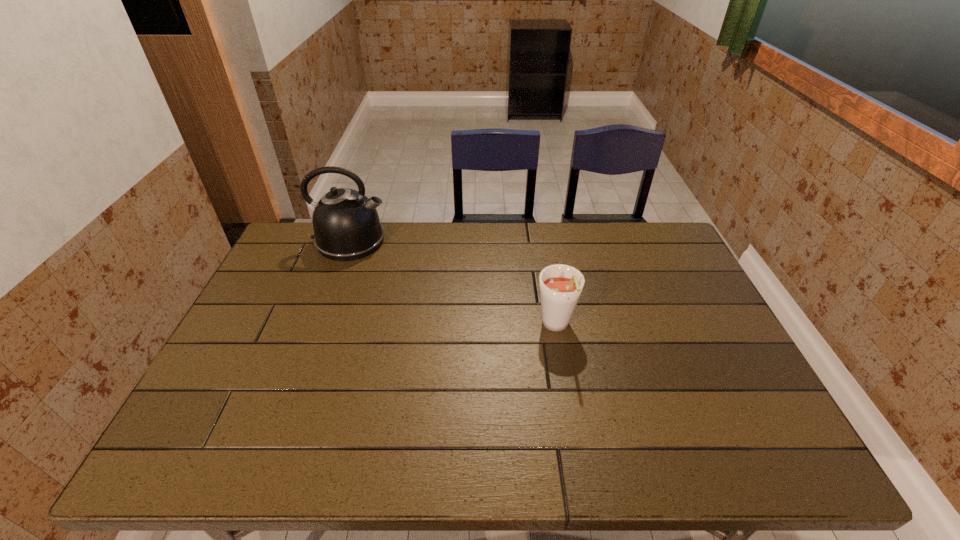
The height and width of the screenshot is (540, 960). In the image, there is a desktop. Find the location of `vacant space at the near edge`. vacant space at the near edge is located at coordinates (367, 436).

You are a GUI agent. You are given a task and a screenshot of the screen. Output one action in this format:
    pyautogui.click(x=<x>, y=<y>)
    Task: Click on the vacant space at the left edge
    The height and width of the screenshot is (540, 960).
    Given the screenshot: What is the action you would take?
    pyautogui.click(x=276, y=332)

Where is `blank space at the right edge of the desktop`? blank space at the right edge of the desktop is located at coordinates (696, 360).

What are the coordinates of `blank area at the far right corner` in the screenshot? It's located at (663, 238).

In the image, there is a desktop. Where is `vacant space at the near right corner`? This screenshot has width=960, height=540. vacant space at the near right corner is located at coordinates (768, 433).